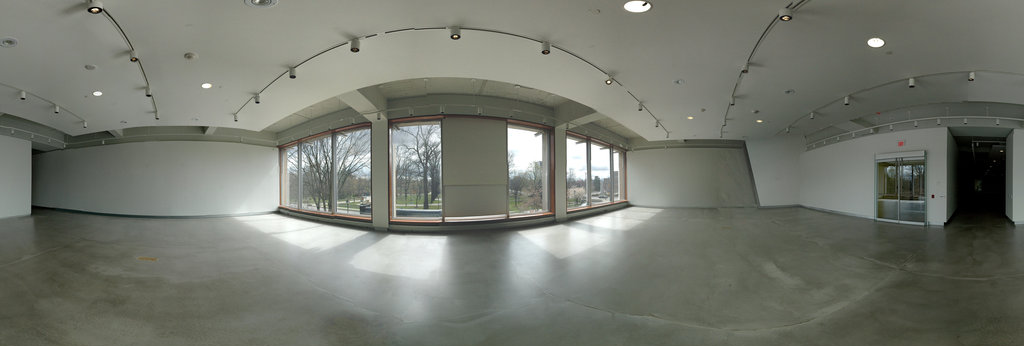
You are a GUI agent. You are given a task and a screenshot of the screen. Output one action in this format:
    pyautogui.click(x=<x>, y=<y>)
    Task: Click on the window shade
    This screenshot has width=1024, height=346.
    Given the screenshot: What is the action you would take?
    pyautogui.click(x=476, y=165)